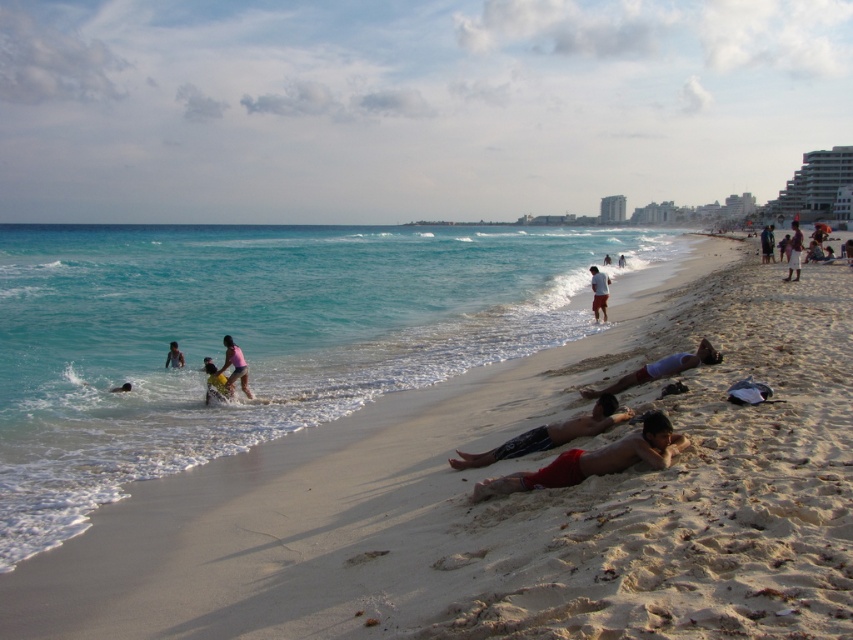
Question: Which object is farther from the camera taking this photo?

Choices:
 (A) dark blue fabric at lower right
 (B) red fabric shorts at lower center

Answer: (A)

Question: Which object appears farthest from the camera in this image?

Choices:
 (A) white cotton shorts at center
 (B) yellow fabric at lower center
 (C) pink fabric at center
 (D) red fabric shorts at lower center

Answer: (A)

Question: From the image, what is the correct spatial relationship of red fabric shorts at center in relation to pink fabric bikini at center?

Choices:
 (A) right
 (B) left

Answer: (A)

Question: Is clear blue water at beach center to the left of pink fabric bikini at center from the viewer's perspective?

Choices:
 (A) yes
 (B) no

Answer: (A)

Question: Is pink fabric at center further to the viewer compared to matte pink swimsuit at center?

Choices:
 (A) no
 (B) yes

Answer: (A)

Question: Which of the following is the closest to the observer?

Choices:
 (A) light brown skin at lower left
 (B) light blue fabric shorts at center
 (C) yellow fabric at lower center
 (D) white cotton shorts at center

Answer: (B)